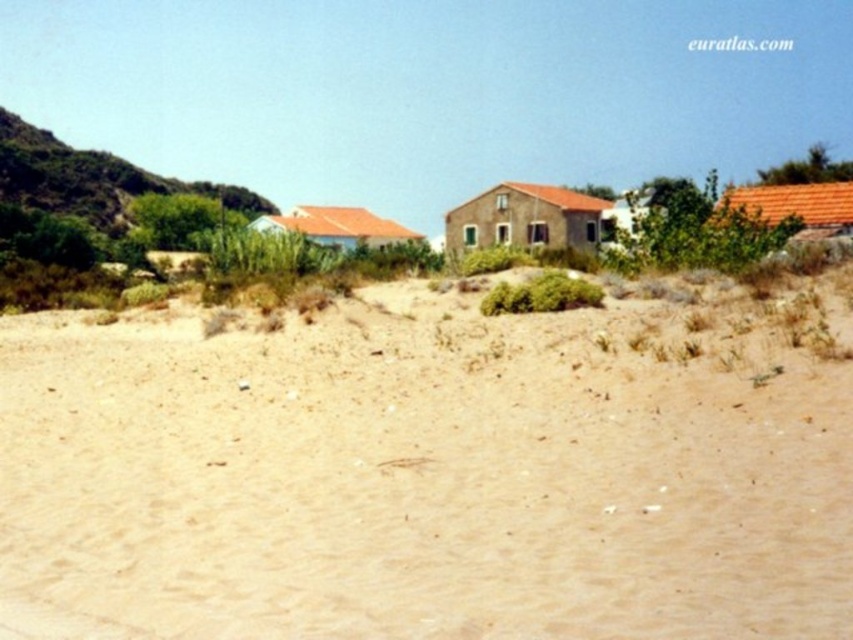
You are standing on the light brown sand at lower center and want to walk to the green shrubbery at left. Which direction should you move?

You should move to the left because the light brown sand at lower center is to the right of green shrubbery at left.